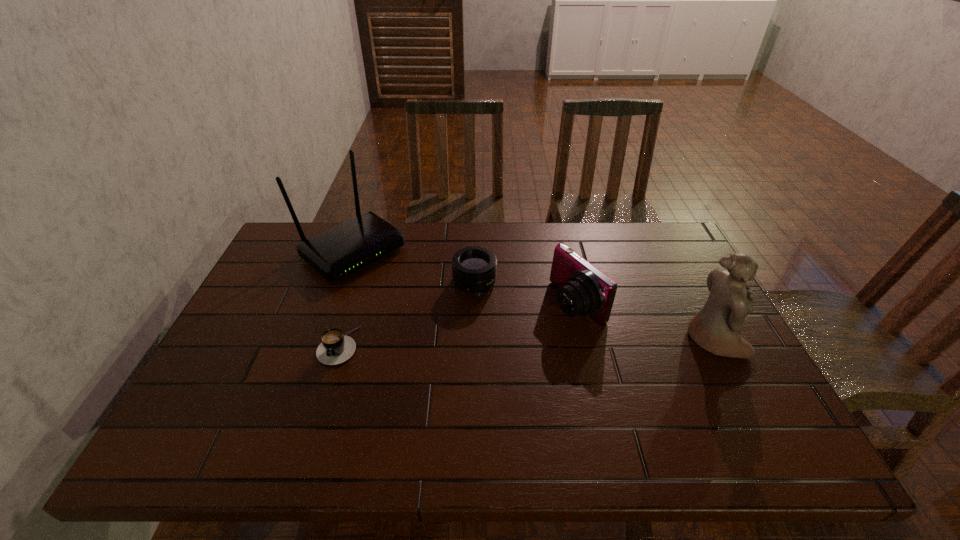
What are the coordinates of `empty space that is in between the cappuccino and the rightmost object` in the screenshot? It's located at (526, 342).

You are a GUI agent. You are given a task and a screenshot of the screen. Output one action in this format:
    pyautogui.click(x=<x>, y=<y>)
    Task: Click on the free space between the camera and the cappuccino
    Image resolution: width=960 pixels, height=540 pixels.
    Given the screenshot: What is the action you would take?
    pyautogui.click(x=458, y=325)

I want to click on empty space that is in between the cappuccino and the telephoto lens, so click(406, 314).

Where is `vacant space that's between the router and the cappuccino`? vacant space that's between the router and the cappuccino is located at coordinates (346, 298).

This screenshot has height=540, width=960. I want to click on vacant area that lies between the figurine and the router, so click(533, 295).

Locate an element on the screen. This screenshot has height=540, width=960. vacant point located between the telephoto lens and the router is located at coordinates (414, 267).

I want to click on the second closest object to the fourth tallest object, so click(336, 253).

Locate an element on the screen. This screenshot has width=960, height=540. the fourth closest object to the figurine is located at coordinates (335, 348).

You are a GUI agent. You are given a task and a screenshot of the screen. Output one action in this format:
    pyautogui.click(x=<x>, y=<y>)
    Task: Click on the free space that satisfies the following two spatial constraints: 1. on the front side of the telephoto lens; 2. on the front-facing side of the figurine
    
    Given the screenshot: What is the action you would take?
    pyautogui.click(x=474, y=339)